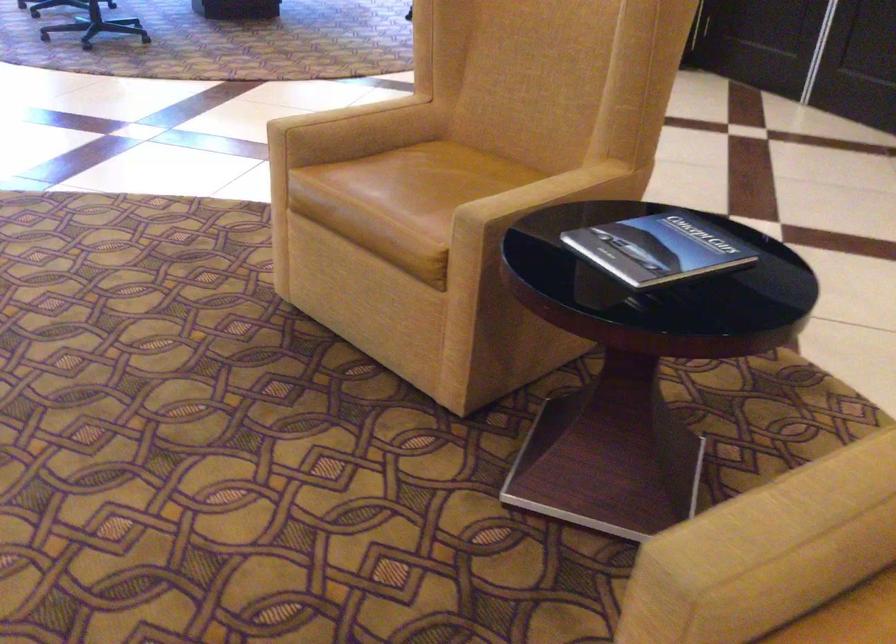
Find where to sit the chair sitting surface. Please return your answer as a coordinate pair (x, y).

(440, 174)